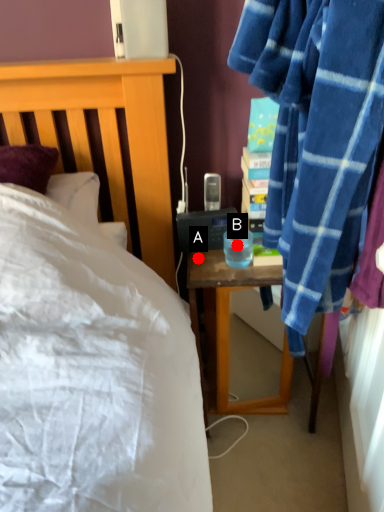
Question: Two points are circled on the image, labeled by A and B beside each circle. Which point is closer to the camera taking this photo?

Choices:
 (A) A is closer
 (B) B is closer

Answer: (B)